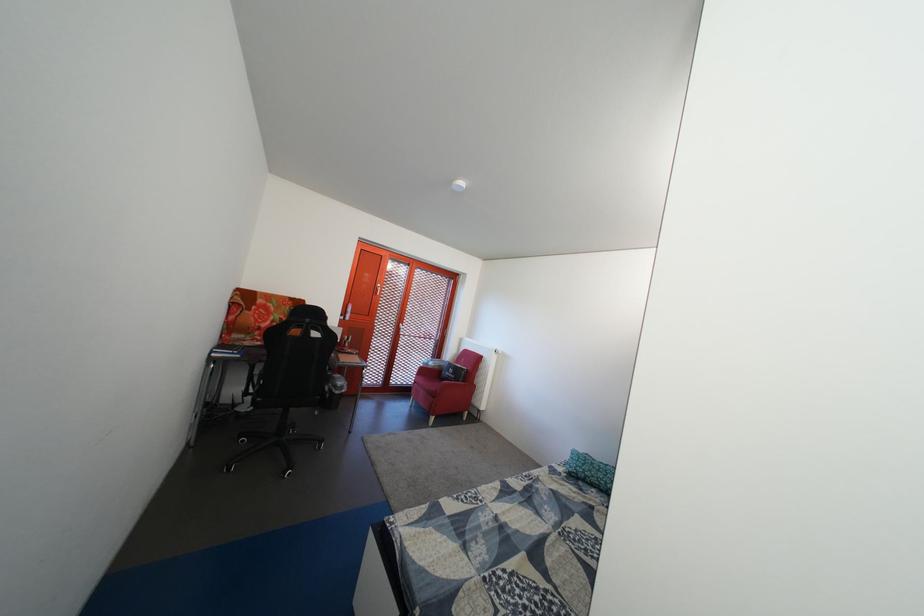
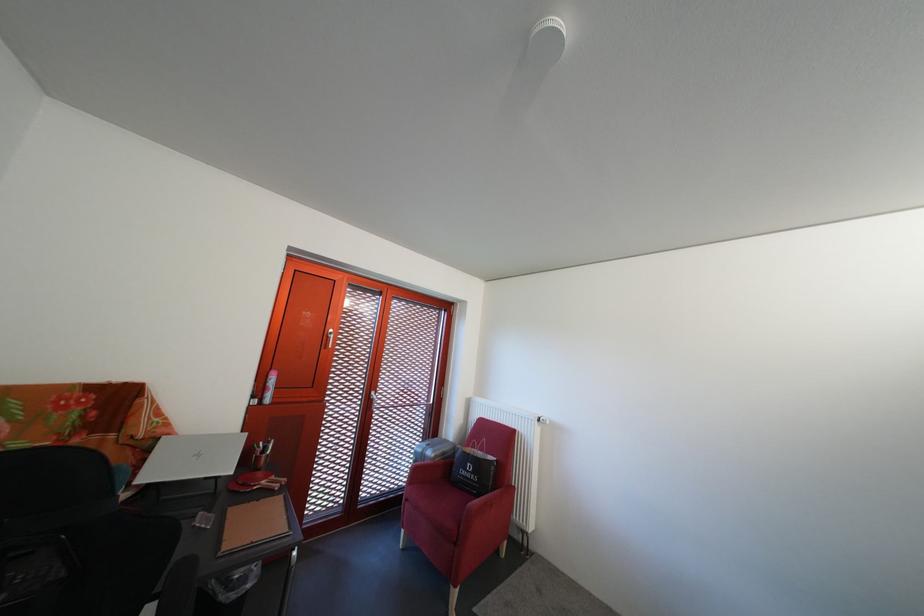
The point at (442,370) is marked in the first image. Where is the corresponding point in the second image?

(441, 459)